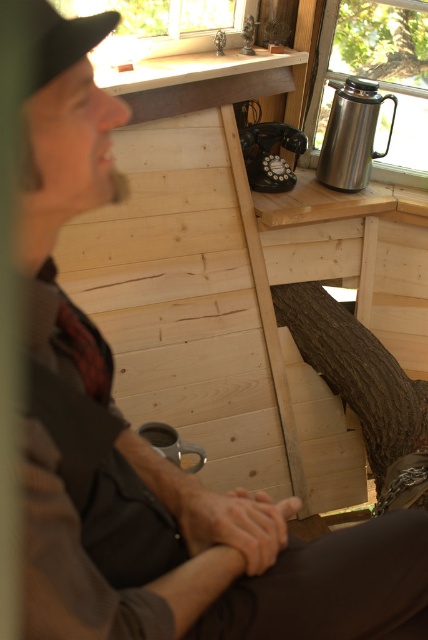
Does dark brown wood tree trunk at center lie in front of brown rough bark tree at upper right?

That is True.

Which is above, dark brown wood tree trunk at center or brown rough bark tree at upper right?

brown rough bark tree at upper right is higher up.

Is point (363, 358) farther from camera compared to point (341, 17)?

No, (363, 358) is closer to viewer.

What are the coordinates of `dark brown wood tree trunk at center` in the screenshot? It's located at (356, 371).